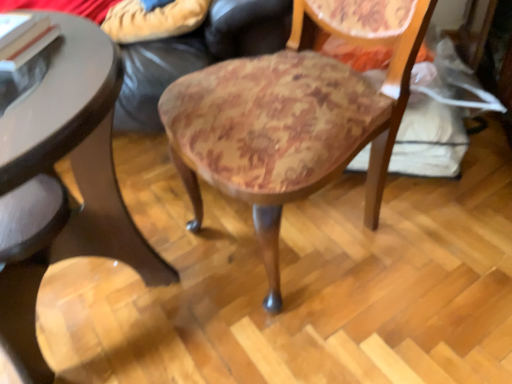
Describe the element at coordinates (294, 116) in the screenshot. I see `wooden upholstered chair at center` at that location.

What do you see at coordinates (196, 54) in the screenshot? I see `leather couch at center` at bounding box center [196, 54].

Where is `wooden upholstered chair at center`? The image size is (512, 384). wooden upholstered chair at center is located at coordinates (294, 116).

Is wooden upholstered chair at center further to the viewer compared to leather couch at center?

No, the depth of wooden upholstered chair at center is less than that of leather couch at center.

Which is nearer, (242, 81) or (184, 72)?

Point (242, 81) appears to be closer to the viewer than point (184, 72).

Is wooden upholstered chair at center shorter than leather couch at center?

No, wooden upholstered chair at center is not shorter than leather couch at center.

Locate an element on the screen. chair above the wooden round table at lower left (from a real-world perspective) is located at coordinates (294, 116).

Based on the photo, how many degrees apart are the facing directions of wooden upholstered chair at center and wooden round table at lower left?

40.1 degrees separate the facing orientations of wooden upholstered chair at center and wooden round table at lower left.

Which of these two, wooden upholstered chair at center or wooden round table at lower left, is smaller?

Smaller between the two is wooden upholstered chair at center.

Considering the positions of objects leather couch at center and wooden round table at lower left in the image provided, who is more to the left, leather couch at center or wooden round table at lower left?

leather couch at center.

Can you confirm if leather couch at center is thinner than wooden round table at lower left?

In fact, leather couch at center might be wider than wooden round table at lower left.

Would you say leather couch at center is outside wooden round table at lower left?

Yes, leather couch at center is outside of wooden round table at lower left.

From a real-world perspective, is leather couch at center above or below wooden round table at lower left?

Clearly, from a real-world perspective, leather couch at center is below wooden round table at lower left.

Which object is positioned more to the right, leather couch at center or wooden upholstered chair at center?

wooden upholstered chair at center.

Consider the image. Can you tell me how much leather couch at center and wooden upholstered chair at center differ in facing direction?

The angular difference between leather couch at center and wooden upholstered chair at center is 36.8 degrees.

From a real-world perspective, which object stands above the other?

In real-world perspective, wooden upholstered chair at center is above.

Is leather couch at center shorter than wooden upholstered chair at center?

Indeed, leather couch at center has a lesser height compared to wooden upholstered chair at center.

Would you say wooden round table at lower left is a long distance from leather couch at center?

wooden round table at lower left is actually quite close to leather couch at center.

You are a GUI agent. You are given a task and a screenshot of the screen. Output one action in this format:
    pyautogui.click(x=<x>, y=<y>)
    Task: Click on the couch on the left of wooden round table at lower left
    The width and height of the screenshot is (512, 384).
    Given the screenshot: What is the action you would take?
    pyautogui.click(x=196, y=54)

From the picture: Is wooden round table at lower left to the left of leather couch at center from the viewer's perspective?

No, wooden round table at lower left is not to the left of leather couch at center.

From a real-world perspective, is wooden round table at lower left positioned above or below leather couch at center?

Clearly, from a real-world perspective, wooden round table at lower left is above leather couch at center.

From the image's perspective, which one is positioned higher, wooden round table at lower left or wooden upholstered chair at center?

wooden upholstered chair at center, from the image's perspective.

Would you say wooden round table at lower left is outside wooden upholstered chair at center?

Yes, wooden round table at lower left is outside of wooden upholstered chair at center.

Does wooden round table at lower left appear on the right side of wooden upholstered chair at center?

No.

At what (x,y) coordinates should I click in order to perform the action: click on couch on the left of wooden upholstered chair at center. Please return your answer as a coordinate pair (x, y). The image size is (512, 384). Looking at the image, I should click on (196, 54).

Where is `chair on the right of wooden round table at lower left`? This screenshot has height=384, width=512. chair on the right of wooden round table at lower left is located at coordinates (294, 116).

From the image, which object appears to be nearer to leather couch at center, wooden upholstered chair at center or wooden round table at lower left?

The object closer to leather couch at center is wooden upholstered chair at center.

When comparing their distances from wooden upholstered chair at center, does leather couch at center or wooden round table at lower left seem closer?

leather couch at center.

Which object lies nearer to the anchor point wooden upholstered chair at center, wooden round table at lower left or leather couch at center?

The object closer to wooden upholstered chair at center is leather couch at center.

Based on their spatial positions, is wooden upholstered chair at center or leather couch at center closer to wooden round table at lower left?

wooden upholstered chair at center is closer to wooden round table at lower left.

From the image, which object appears to be farther from wooden round table at lower left, leather couch at center or wooden upholstered chair at center?

A: Based on the image, leather couch at center appears to be further to wooden round table at lower left.

Which object lies nearer to the anchor point leather couch at center, wooden round table at lower left or wooden upholstered chair at center?

wooden upholstered chair at center.

Where is `table between leather couch at center and wooden upholstered chair at center from left to right`? table between leather couch at center and wooden upholstered chair at center from left to right is located at coordinates (56, 174).